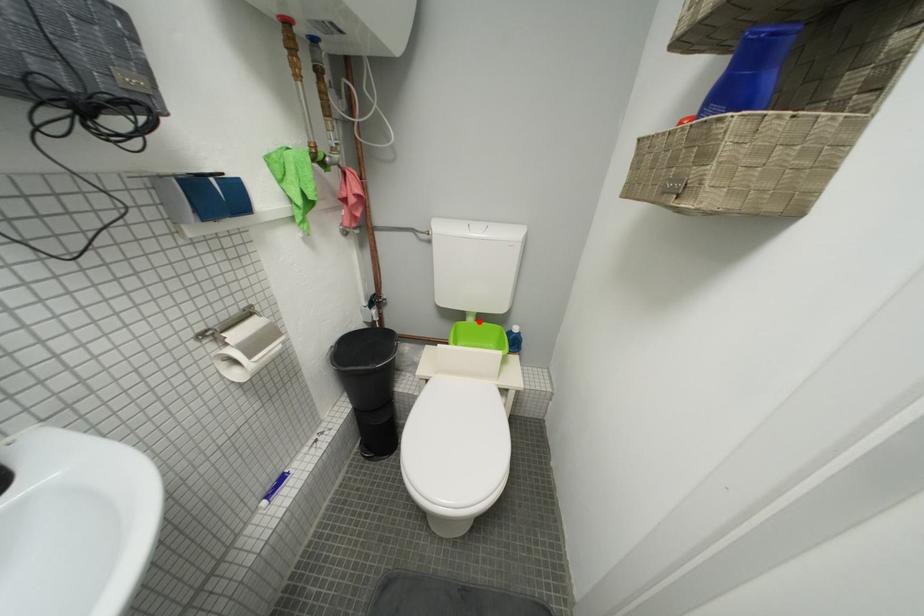
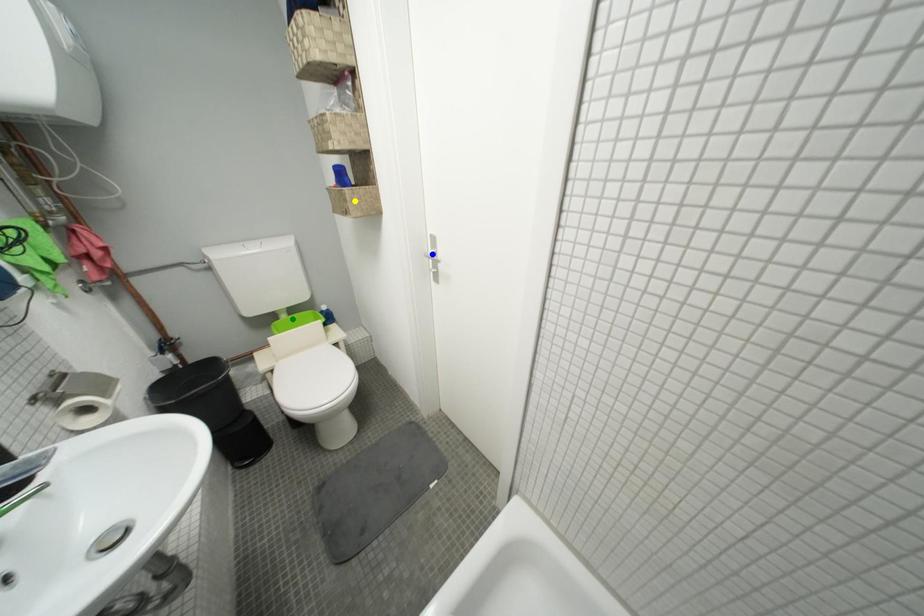
Question: I am providing you with two images of the same scene from different viewpoints. A red point is marked on the first image. You are given multiple points on the second image. Which spot in image 2 lines up with the point in image 1?

Choices:
 (A) green point
 (B) blue point
 (C) yellow point

Answer: (A)